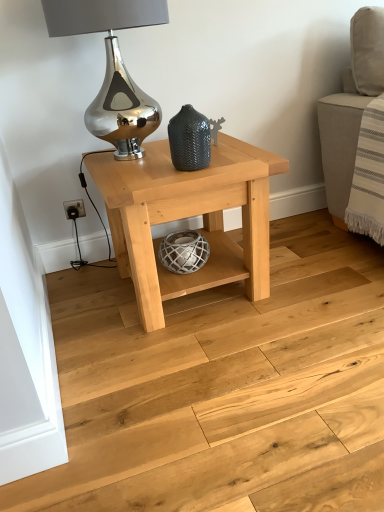
What are the coordinates of `vacant region to the left of natural wood table at center` in the screenshot? It's located at (86, 304).